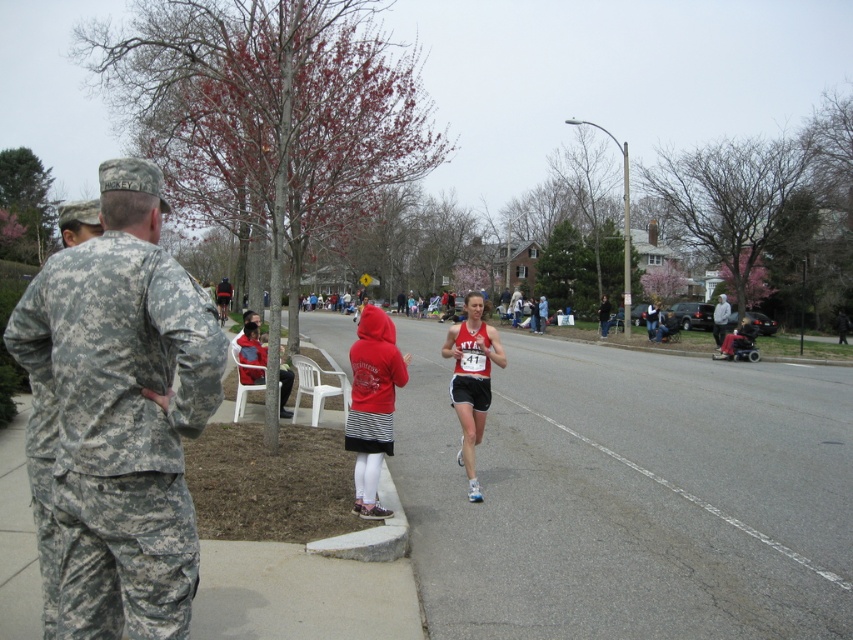
You are a runner participating in the marathon and need to decide whether to step onto the gray asphalt road at center or the dark blue jacket at center. Which one is shorter in height?

The gray asphalt road at center is not as tall as dark blue jacket at center, so the gray asphalt road at center is shorter in height.

You are a photographer positioned at the starting line of the marathon. You need to capture a photo of both the red hoodie at left and the gray hoodie at center in the same frame. Which runner should you focus on first to ensure both are in the shot?

The red hoodie at left has a smaller width than the gray hoodie at center. To capture both in the same frame, focus on the gray hoodie at center first since it is larger and will require more space in the composition, ensuring the smaller red hoodie at left can also fit into the shot.

You are a photographer at the marathon event. You need to capture a photo of the runner wearing the red hoodie at center without the gray hoodie at center blocking the view. Is this possible given their current positions?

The red hoodie at center is positioned under the gray hoodie at center, so it is blocked by the gray hoodie at center. Therefore, you cannot capture a clear photo of the red hoodie at center without the gray hoodie at center obstructing the view.